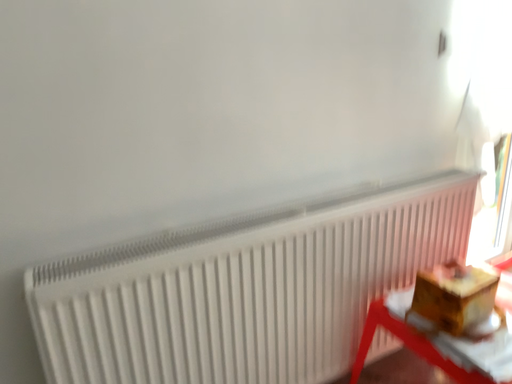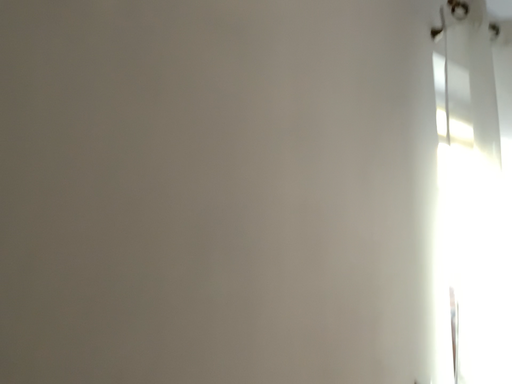
Question: How did the camera likely rotate when shooting the video?

Choices:
 (A) rotated downward
 (B) rotated upward

Answer: (B)